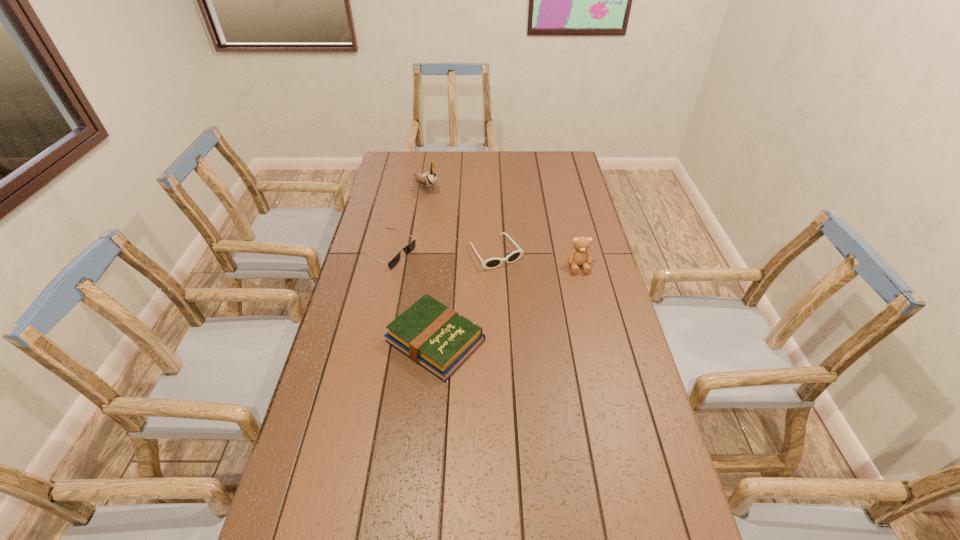
Image resolution: width=960 pixels, height=540 pixels. Identify the location of free spot on the desktop that is between the third tallest object and the rightmost object and is positioned at the face of the farthest object. (531, 291).

Locate an element on the screen. The height and width of the screenshot is (540, 960). vacant spot on the desktop that is between the book and the teddy bear and is positioned on the front-facing side of the left sunglasses is located at coordinates (506, 304).

This screenshot has width=960, height=540. I want to click on free spot on the desktop that is between the nearest object and the second tallest object and is positioned with the lenses of the right sunglasses facing outward, so click(526, 294).